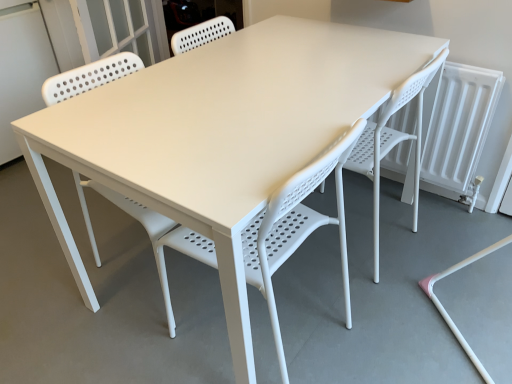
What do you see at coordinates (296, 228) in the screenshot? Image resolution: width=512 pixels, height=384 pixels. I see `white plastic chair at center, the 1th chair positioned from the left` at bounding box center [296, 228].

The image size is (512, 384). In order to click on white plastic chair at center, which is counted as the 1th chair, starting from the right in this screenshot , I will do `click(393, 142)`.

Which object is positioned more to the left, white plastic chair at center, which is counted as the 1th chair, starting from the right, or white plastic screen door at upper left?

Positioned to the left is white plastic screen door at upper left.

Is white plastic chair at center, which appears as the second chair when viewed from the left, facing towards white plastic screen door at upper left?

Yes.

Can you confirm if white plastic chair at center, which is counted as the 1th chair, starting from the right, is thinner than white plastic screen door at upper left?

Yes.

From a real-world perspective, is white plastic chair at center, which is counted as the 1th chair, starting from the right, positioned above or below white plastic screen door at upper left?

white plastic chair at center, which is counted as the 1th chair, starting from the right, is situated lower than white plastic screen door at upper left in the real world.

Between point (42, 62) and point (350, 317), which one is positioned behind?

The point (42, 62) is farther.

From the image's perspective, is white plastic screen door at upper left on white plastic chair at center, which appears as the second chair when viewed from the right?

Yes, from the image's perspective, white plastic screen door at upper left is above white plastic chair at center, which appears as the second chair when viewed from the right.

In the image, is white plastic screen door at upper left positioned in front of or behind white plastic chair at center, the 1th chair positioned from the left?

In the image, white plastic screen door at upper left appears behind white plastic chair at center, the 1th chair positioned from the left.

The image size is (512, 384). Identify the location of the 1st chair positioned below the white plastic screen door at upper left (from a real-world perspective). (296, 228).

Which object is further away from the camera taking this photo, white plastic chair at center, which appears as the second chair when viewed from the right, or white plastic screen door at upper left?

white plastic screen door at upper left is more distant.

Can you confirm if white plastic chair at center, which appears as the second chair when viewed from the right, is smaller than white plastic screen door at upper left?

Yes, white plastic chair at center, which appears as the second chair when viewed from the right, is smaller than white plastic screen door at upper left.

From the picture: Is white plastic chair at center, the 1th chair positioned from the left, to the left of white plastic screen door at upper left from the viewer's perspective?

In fact, white plastic chair at center, the 1th chair positioned from the left, is to the right of white plastic screen door at upper left.

Which is behind, point (272, 289) or point (27, 53)?

The point (27, 53) is more distant.

Is white plastic chair at center, which appears as the second chair when viewed from the right, shorter than white plastic chair at center, which is counted as the 1th chair, starting from the right?

Correct, white plastic chair at center, which appears as the second chair when viewed from the right, is not as tall as white plastic chair at center, which is counted as the 1th chair, starting from the right.

From a real-world perspective, between white plastic chair at center, the 1th chair positioned from the left, and white plastic chair at center, which is counted as the 1th chair, starting from the right, who is vertically higher?

white plastic chair at center, the 1th chair positioned from the left, is physically above.

Is white plastic chair at center, which appears as the second chair when viewed from the right, far from white plastic chair at center, which is counted as the 1th chair, starting from the right?

No, there isn't a large distance between white plastic chair at center, which appears as the second chair when viewed from the right, and white plastic chair at center, which is counted as the 1th chair, starting from the right.

Would you say white plastic chair at center, which appears as the second chair when viewed from the left, is inside or outside white plastic chair at center, the 1th chair positioned from the left?

white plastic chair at center, which appears as the second chair when viewed from the left, is spatially situated outside white plastic chair at center, the 1th chair positioned from the left.

From a real-world perspective, relative to white plastic chair at center, the 1th chair positioned from the left, is white plastic chair at center, which is counted as the 1th chair, starting from the right, vertically above or below?

From a real-world perspective, white plastic chair at center, which is counted as the 1th chair, starting from the right, is physically below white plastic chair at center, the 1th chair positioned from the left.

From the image's perspective, relative to white plastic chair at center, which appears as the second chair when viewed from the right, is white plastic chair at center, which is counted as the 1th chair, starting from the right, above or below?

Based on their image positions, white plastic chair at center, which is counted as the 1th chair, starting from the right, is located above white plastic chair at center, which appears as the second chair when viewed from the right.

Is white plastic chair at center, which is counted as the 1th chair, starting from the right, aimed at white plastic chair at center, the 1th chair positioned from the left?

No, white plastic chair at center, which is counted as the 1th chair, starting from the right, is not turned towards white plastic chair at center, the 1th chair positioned from the left.

From the image's perspective, is white plastic screen door at upper left beneath white plastic chair at center, which is counted as the 1th chair, starting from the right?

Actually, white plastic screen door at upper left appears above white plastic chair at center, which is counted as the 1th chair, starting from the right, in the image.

Which chair is the 2nd one when counting from the right side of the white plastic screen door at upper left? Please provide its 2D coordinates.

[(393, 142)]

Which object is positioned more to the left, white plastic screen door at upper left or white plastic chair at center, which is counted as the 1th chair, starting from the right?

white plastic screen door at upper left is more to the left.

Is point (17, 9) closer or farther from the camera than point (424, 69)?

Point (17, 9) is farther from the camera than point (424, 69).

Identify the location of screen door above the white plastic chair at center, which is counted as the 1th chair, starting from the right (from a real-world perspective). This screenshot has width=512, height=384. (21, 67).

Which chair is the 1st one when counting from the right side of the white plastic screen door at upper left? Please provide its 2D coordinates.

[(296, 228)]

From the picture: From the image, which object appears to be nearer to white plastic screen door at upper left, white plastic chair at center, which appears as the second chair when viewed from the left, or white plastic chair at center, the 1th chair positioned from the left?

white plastic chair at center, the 1th chair positioned from the left, is positioned closer to the anchor white plastic screen door at upper left.

From the image, which object appears to be nearer to white plastic screen door at upper left, white plastic chair at center, the 1th chair positioned from the left, or white plastic chair at center, which appears as the second chair when viewed from the left?

white plastic chair at center, the 1th chair positioned from the left, is closer to white plastic screen door at upper left.

From the image, which object appears to be nearer to white plastic chair at center, which is counted as the 1th chair, starting from the right, white plastic chair at center, which appears as the second chair when viewed from the right, or white plastic screen door at upper left?

Based on the image, white plastic chair at center, which appears as the second chair when viewed from the right, appears to be nearer to white plastic chair at center, which is counted as the 1th chair, starting from the right.

Estimate the real-world distances between objects in this image. Which object is closer to white plastic chair at center, which appears as the second chair when viewed from the right, white plastic screen door at upper left or white plastic chair at center, which appears as the second chair when viewed from the left?

Among the two, white plastic chair at center, which appears as the second chair when viewed from the left, is located nearer to white plastic chair at center, which appears as the second chair when viewed from the right.

Which object lies further to the anchor point white plastic chair at center, the 1th chair positioned from the left, white plastic chair at center, which appears as the second chair when viewed from the left, or white plastic screen door at upper left?

white plastic screen door at upper left is further to white plastic chair at center, the 1th chair positioned from the left.

Considering their positions, is white plastic screen door at upper left positioned closer to white plastic chair at center, which is counted as the 1th chair, starting from the right, than white plastic chair at center, which appears as the second chair when viewed from the right?

white plastic chair at center, which appears as the second chair when viewed from the right, is closer to white plastic chair at center, which is counted as the 1th chair, starting from the right.

The image size is (512, 384). Find the location of `chair between white plastic screen door at upper left and white plastic chair at center, which is counted as the 1th chair, starting from the right`. chair between white plastic screen door at upper left and white plastic chair at center, which is counted as the 1th chair, starting from the right is located at coordinates (296, 228).